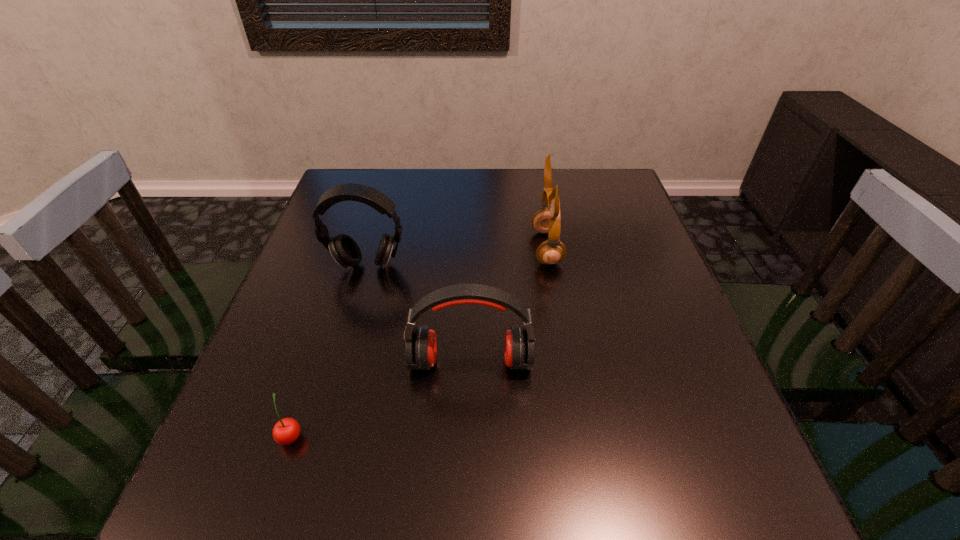
The image size is (960, 540). Identify the location of free space located on the ear cups of the second object from right to left. (468, 457).

I want to click on free space located on the back of the cherry, so click(328, 325).

Locate an element on the screen. This screenshot has width=960, height=540. earphone at the left edge is located at coordinates (346, 252).

You are a GUI agent. You are given a task and a screenshot of the screen. Output one action in this format:
    pyautogui.click(x=<x>, y=<y>)
    Task: Click on the cherry present at the left edge
    This screenshot has height=540, width=960.
    Given the screenshot: What is the action you would take?
    pyautogui.click(x=286, y=431)

Locate an element on the screen. This screenshot has width=960, height=540. vacant space at the far edge is located at coordinates (486, 173).

The width and height of the screenshot is (960, 540). What are the coordinates of `vacant position at the near edge of the desktop` in the screenshot? It's located at (645, 528).

I want to click on vacant region at the left edge of the desktop, so click(x=302, y=370).

Find the location of `free space at the right edge`. free space at the right edge is located at coordinates (637, 333).

This screenshot has height=540, width=960. In order to click on free point at the near left corner in this screenshot , I will do `click(298, 493)`.

In the image, there is a desktop. Where is `free space at the far right corner`? free space at the far right corner is located at coordinates (579, 176).